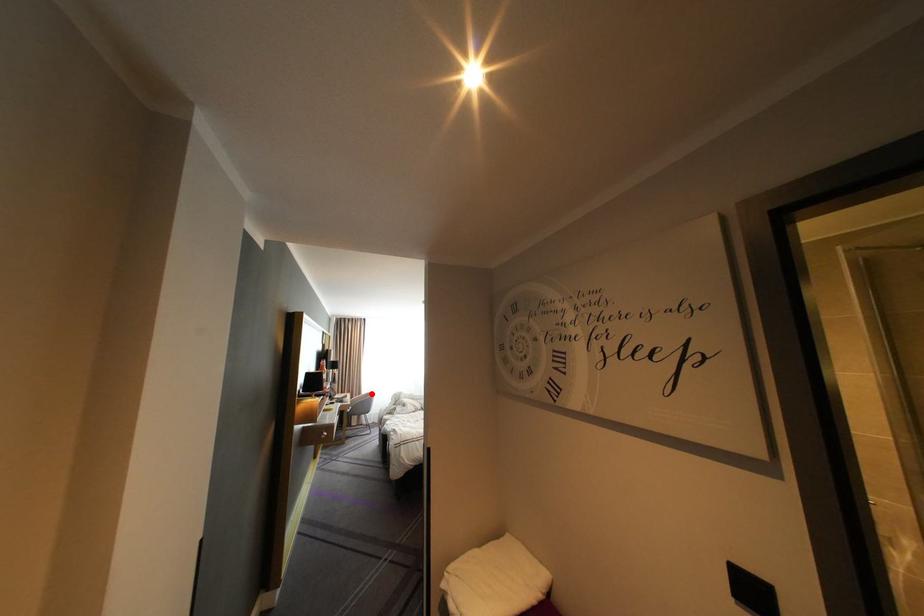
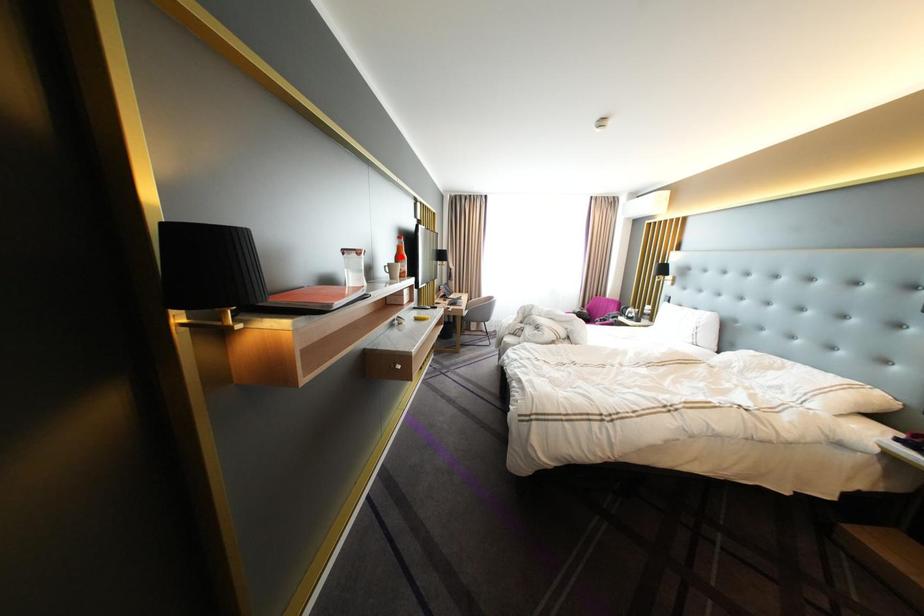
I am providing you with two images of the same scene from different viewpoints. A red point is marked on the first image and another point is marked on the second image. Do the highlighted points in image1 and image2 indicate the same real-world spot?

No